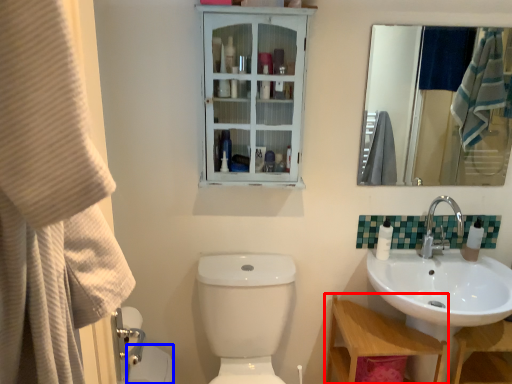
Question: Which point is closer to the camera, table (highlighted by a red box) or toilet bowl (highlighted by a blue box)?

Choices:
 (A) table
 (B) toilet bowl

Answer: (A)